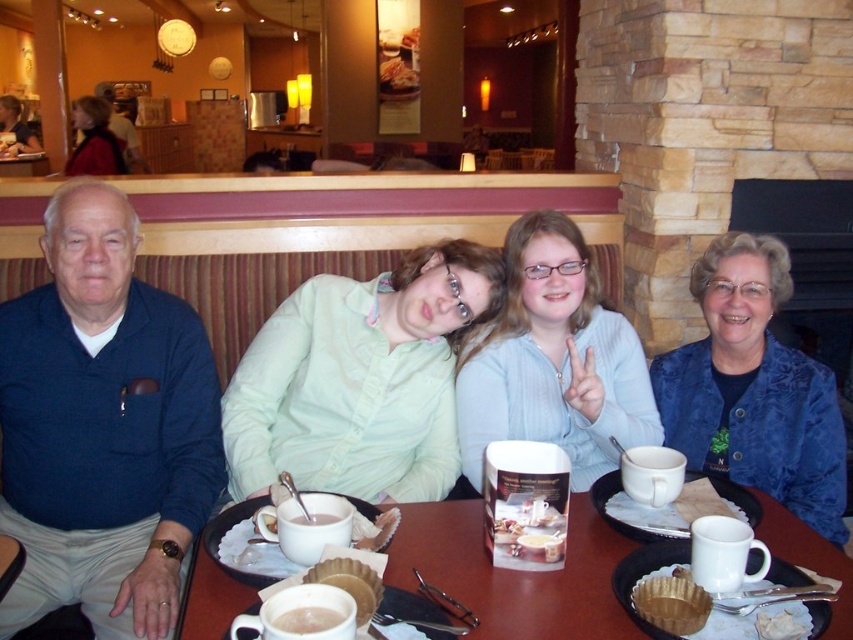
Is white ceramic mug at center below baked paper cupcake liner at lower center?

No, white ceramic mug at center is not below baked paper cupcake liner at lower center.

Which of these two, white ceramic mug at center or baked paper cupcake liner at lower center, stands shorter?

baked paper cupcake liner at lower center is shorter.

Who is more forward, (204, 557) or (685, 632)?

Positioned in front is point (685, 632).

Locate an element on the screen. Image resolution: width=853 pixels, height=640 pixels. white ceramic mug at center is located at coordinates (515, 573).

How far apart are blue textured jacket at upper right and matte black jacket at upper left?

They are 4.50 meters apart.

Who is more distant from viewer, [785,300] or [100,152]?

Point [100,152]

Find the location of a particular element. This screenshot has height=640, width=853. blue textured jacket at upper right is located at coordinates (753, 388).

Is light green shirt at center closer to camera compared to white matte coffee cup at lower center?

That is False.

Does point (413, 364) come farther from viewer compared to point (323, 620)?

That is True.

At what (x,y) coordinates should I click in order to perform the action: click on light green shirt at center. Please return your answer as a coordinate pair (x, y). Looking at the image, I should click on 360,380.